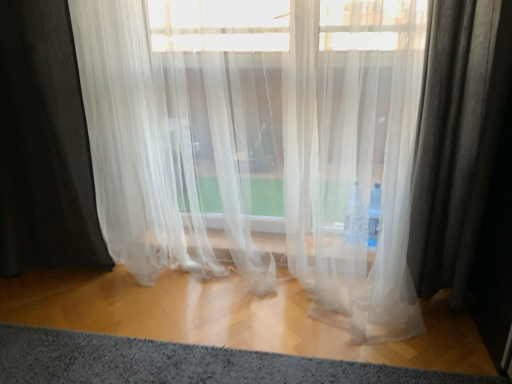
Where is `vacant space underneath gray soft rug at lower center (from a real-world perspective)`? The image size is (512, 384). vacant space underneath gray soft rug at lower center (from a real-world perspective) is located at coordinates (x=165, y=366).